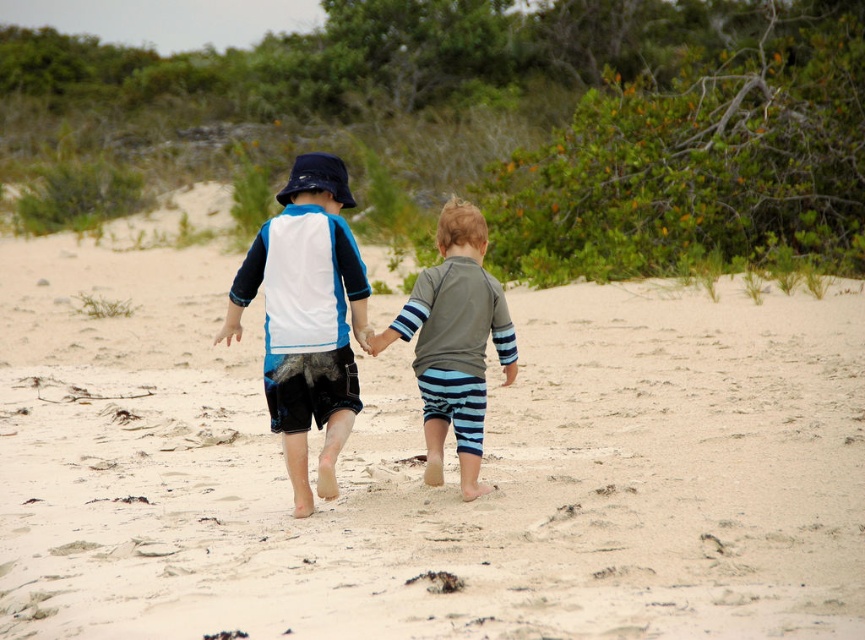
Question: Which object appears closest to the camera in this image?

Choices:
 (A) matte blue and white rash guard at center
 (B) gray matte rash guard at center
 (C) blue striped shorts at center

Answer: (A)

Question: Based on their relative distances, which object is farther from the matte blue and white rash guard at center?

Choices:
 (A) light beige sand at center
 (B) gray matte rash guard at center

Answer: (A)

Question: Does matte blue and white rash guard at center have a greater width compared to blue striped shorts at center?

Choices:
 (A) no
 (B) yes

Answer: (B)

Question: Observing the image, what is the correct spatial positioning of light beige sand at center in reference to gray matte rash guard at center?

Choices:
 (A) right
 (B) left

Answer: (A)

Question: Is light beige sand at center bigger than blue striped shorts at center?

Choices:
 (A) yes
 (B) no

Answer: (A)

Question: Which object is farther from the camera taking this photo?

Choices:
 (A) blue striped shorts at center
 (B) light beige sand at center

Answer: (A)